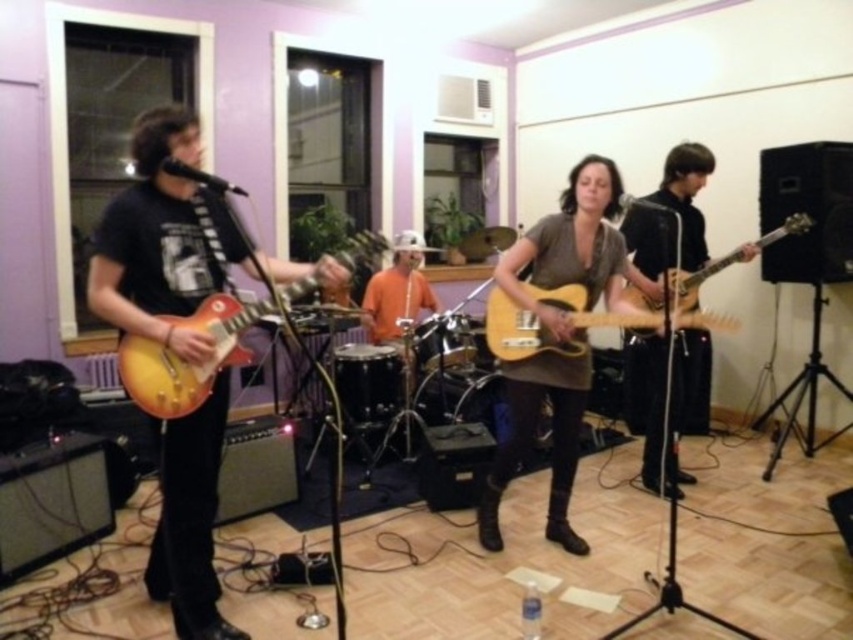
Question: Can you confirm if sunburst wood electric guitar at left is smaller than light wood electric guitar at center?

Choices:
 (A) yes
 (B) no

Answer: (A)

Question: Which object appears farthest from the camera in this image?

Choices:
 (A) light brown wood electric guitar at center
 (B) light wood electric guitar at center
 (C) satin orange guitar at left
 (D) matte brown guitar at right

Answer: (D)

Question: Which of the following is the farthest from the observer?

Choices:
 (A) (509, 360)
 (B) (171, 604)
 (C) (653, 426)

Answer: (C)

Question: Can you confirm if matte brown guitar at right is positioned to the right of light brown wood electric guitar at center?

Choices:
 (A) no
 (B) yes

Answer: (A)

Question: Is light wood electric guitar at center positioned at the back of light brown wood electric guitar at center?

Choices:
 (A) yes
 (B) no

Answer: (B)

Question: Estimate the real-world distances between objects in this image. Which object is closer to the light wood electric guitar at center?

Choices:
 (A) sunburst wood electric guitar at left
 (B) matte brown guitar at right
 (C) satin orange guitar at left
 (D) light brown wood electric guitar at center

Answer: (D)